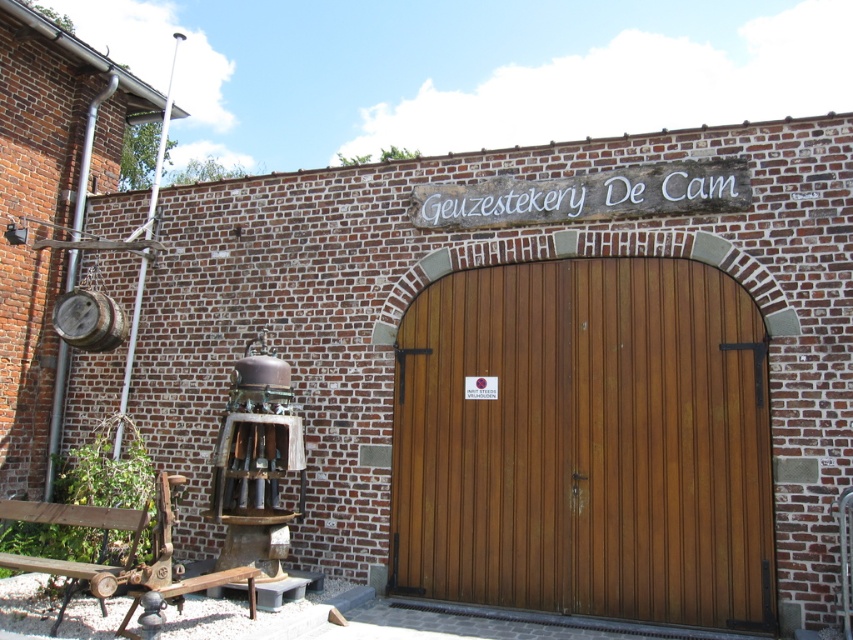
Question: Does wooden at center lie in front of wooden bench at lower left?

Choices:
 (A) yes
 (B) no

Answer: (B)

Question: Can you confirm if wooden at center is positioned to the right of wooden bench at lower left?

Choices:
 (A) no
 (B) yes

Answer: (B)

Question: Which point is farther to the camera?

Choices:
 (A) (68, 595)
 (B) (602, 401)

Answer: (B)

Question: Can you confirm if wooden at center is smaller than wooden bench at lower left?

Choices:
 (A) no
 (B) yes

Answer: (A)